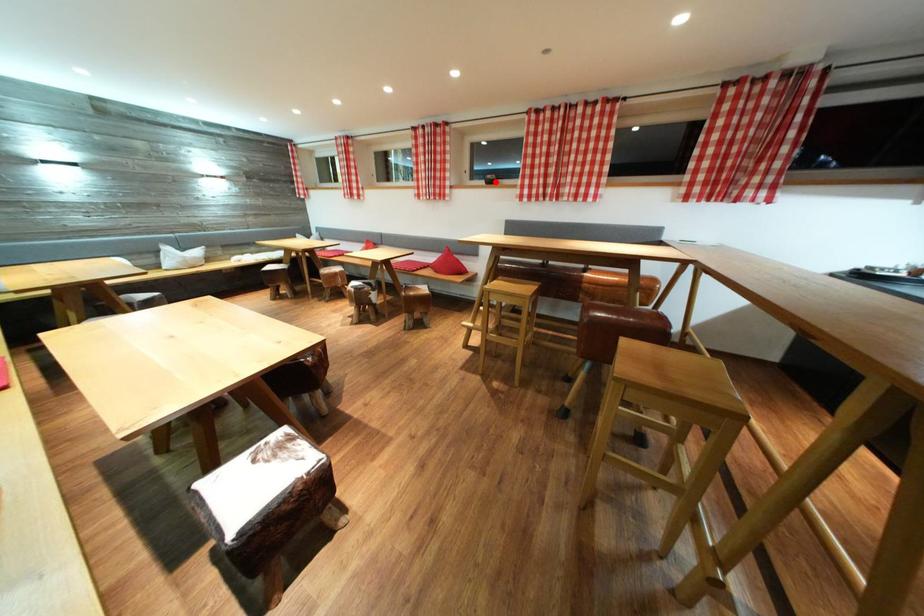
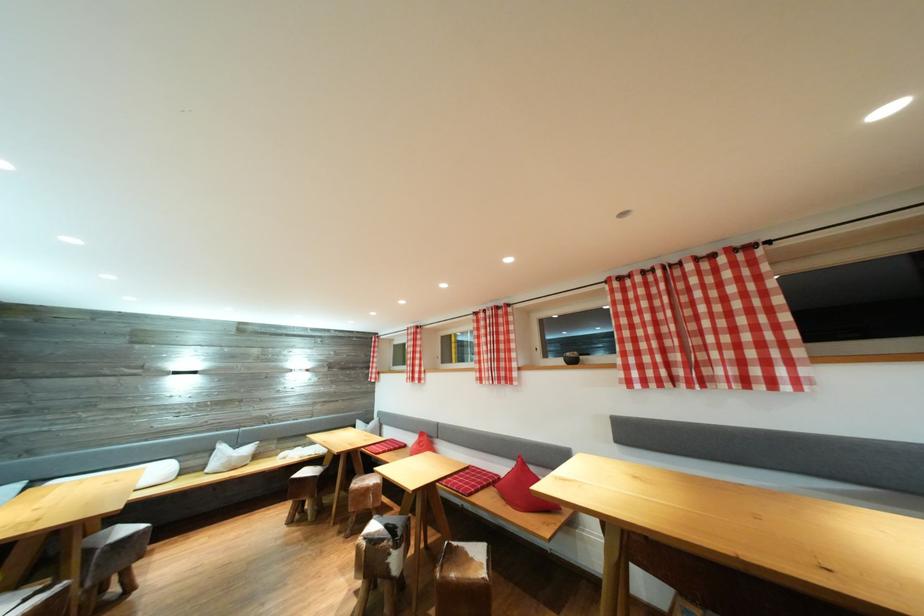
Question: I am providing you with two images of the same scene from different viewpoints. A red point is shown in image1. For the corresponding object point in image2, is it positioned nearer or farther from the camera?

Choices:
 (A) Nearer
 (B) Farther

Answer: (B)